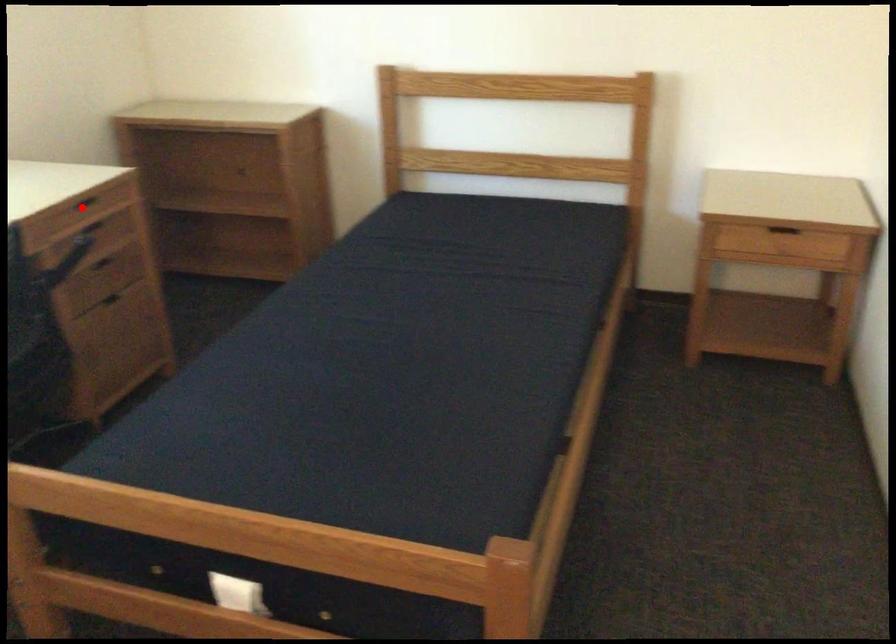
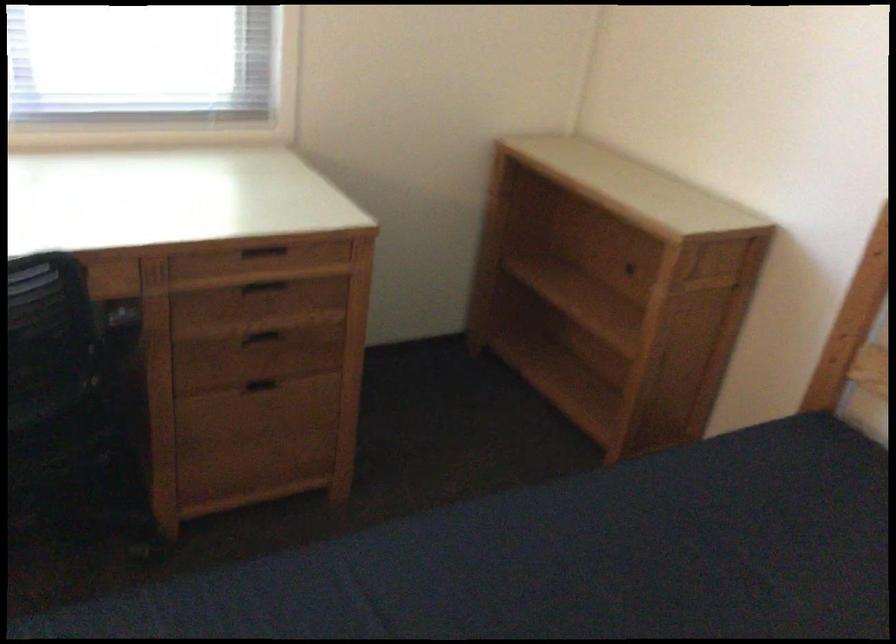
Find the pixel in the second image that matches the highlighted location in the first image.

(263, 252)